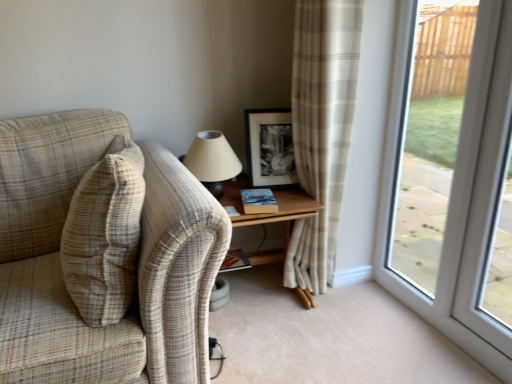
The height and width of the screenshot is (384, 512). I want to click on free space above wooden table at center (from a real-world perspective), so click(x=253, y=195).